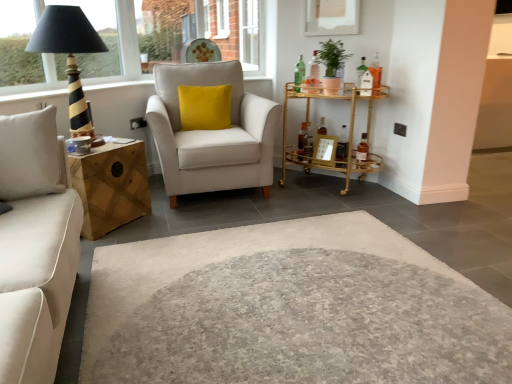
Question: Are gold metallic bar cart at right and green matte plant at upper right beside each other?

Choices:
 (A) yes
 (B) no

Answer: (B)

Question: Does gold metallic bar cart at right appear on the left side of green matte plant at upper right?

Choices:
 (A) no
 (B) yes

Answer: (A)

Question: Is gold metallic bar cart at right positioned behind green matte plant at upper right?

Choices:
 (A) no
 (B) yes

Answer: (A)

Question: Is green matte plant at upper right located within gold metallic bar cart at right?

Choices:
 (A) no
 (B) yes

Answer: (A)

Question: Can you confirm if gold metallic bar cart at right is taller than green matte plant at upper right?

Choices:
 (A) no
 (B) yes

Answer: (B)

Question: Is point (227, 122) closer or farther from the camera than point (245, 18)?

Choices:
 (A) farther
 (B) closer

Answer: (B)

Question: Considering their positions, is yellow velvet pillow at center located in front of or behind white glass window frame at upper center, acting as the first window frame starting from the right?

Choices:
 (A) behind
 (B) front

Answer: (B)

Question: Considering the positions of yellow velvet pillow at center and white glass window frame at upper center, placed as the second window frame when sorted from front to back, in the image, is yellow velvet pillow at center bigger or smaller than white glass window frame at upper center, placed as the second window frame when sorted from front to back,?

Choices:
 (A) small
 (B) big

Answer: (A)

Question: From the image's perspective, is yellow velvet pillow at center positioned above or below white glass window frame at upper center, the 2th window frame when ordered from left to right?

Choices:
 (A) below
 (B) above

Answer: (A)

Question: From the image's perspective, is white glass window frame at upper center, acting as the first window frame starting from the back, located above or below wooden picture frame at center?

Choices:
 (A) below
 (B) above

Answer: (B)

Question: From a real-world perspective, is white glass window frame at upper center, acting as the first window frame starting from the back, above or below wooden picture frame at center?

Choices:
 (A) above
 (B) below

Answer: (A)

Question: Is white glass window frame at upper center, the 2th window frame when ordered from left to right, inside or outside of wooden picture frame at center?

Choices:
 (A) inside
 (B) outside

Answer: (B)

Question: Considering their positions, is white glass window frame at upper center, acting as the first window frame starting from the right, located in front of or behind wooden picture frame at center?

Choices:
 (A) behind
 (B) front

Answer: (A)

Question: In terms of width, does gold metallic bar cart at right look wider or thinner when compared to white glass window frame at upper center, the 2th window frame when ordered from left to right?

Choices:
 (A) thin
 (B) wide

Answer: (B)

Question: In terms of size, does gold metallic bar cart at right appear bigger or smaller than white glass window frame at upper center, acting as the first window frame starting from the back?

Choices:
 (A) small
 (B) big

Answer: (B)